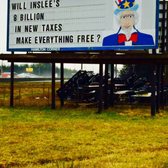
At what (x,y) coordinates should I click in order to perform the action: click on bluish gray background color. Please return your answer as a coordinate pair (x, y). The height and width of the screenshot is (168, 168). Looking at the image, I should click on (67, 12), (143, 16).